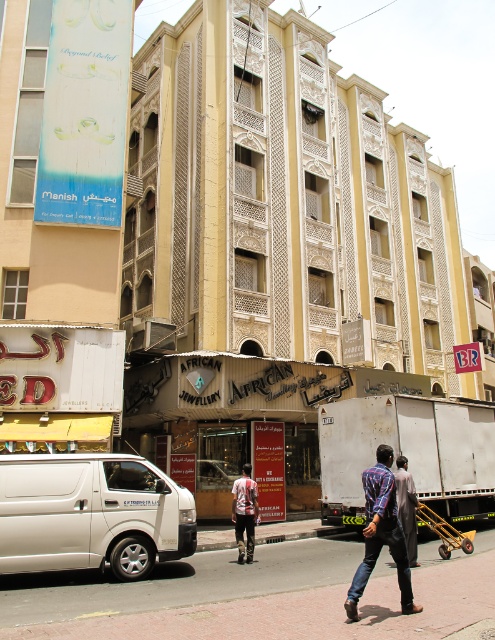
Can you confirm if paved concrete sidewalk at lower center is positioned to the left of dark brown leather jacket at center?

Correct, you'll find paved concrete sidewalk at lower center to the left of dark brown leather jacket at center.

Image resolution: width=495 pixels, height=640 pixels. In order to click on paved concrete sidewalk at lower center in this screenshot , I will do `click(258, 596)`.

Does blue plaid shirt at center have a lesser height compared to reddish-brown leather pants at center?

Incorrect, blue plaid shirt at center's height does not fall short of reddish-brown leather pants at center's.

Is point (392, 552) farther from camera compared to point (237, 540)?

No, it is in front of (237, 540).

Who is more distant from viewer, (x=381, y=524) or (x=242, y=544)?

The point (x=242, y=544) is behind.

This screenshot has height=640, width=495. What are the coordinates of `blue plaid shirt at center` in the screenshot? It's located at (381, 532).

Who is positioned more to the left, white matte van at lower left or reddish-brown leather pants at center?

white matte van at lower left is more to the left.

The width and height of the screenshot is (495, 640). What do you see at coordinates (92, 513) in the screenshot? I see `white matte van at lower left` at bounding box center [92, 513].

Is point (99, 524) behind point (242, 472)?

No, it is not.

Locate an element on the screen. white matte van at lower left is located at coordinates (92, 513).